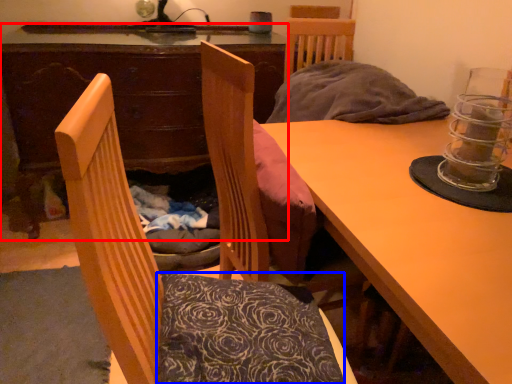
Question: Which point is further to the camera, desk (highlighted by a red box) or pillow (highlighted by a blue box)?

Choices:
 (A) desk
 (B) pillow

Answer: (A)